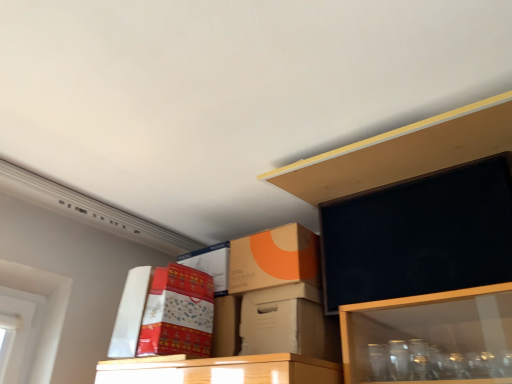
Question: Considering the relative positions of orange matte cardboard box at upper center, positioned as the second box in right-to-left order, and matte cardboard box at upper center in the image provided, is orange matte cardboard box at upper center, positioned as the second box in right-to-left order, behind matte cardboard box at upper center?

Choices:
 (A) no
 (B) yes

Answer: (B)

Question: Is orange matte cardboard box at upper center, positioned as the second box in right-to-left order, to the right of matte cardboard box at upper center from the viewer's perspective?

Choices:
 (A) no
 (B) yes

Answer: (B)

Question: From the image's perspective, is orange matte cardboard box at upper center, which is the second box in left-to-right order, located beneath matte cardboard box at upper center?

Choices:
 (A) no
 (B) yes

Answer: (A)

Question: Is matte cardboard box at upper center a part of orange matte cardboard box at upper center, which is the second box in left-to-right order?

Choices:
 (A) yes
 (B) no

Answer: (B)

Question: From a real-world perspective, is orange matte cardboard box at upper center, positioned as the second box in right-to-left order, beneath matte cardboard box at upper center?

Choices:
 (A) no
 (B) yes

Answer: (A)

Question: Is matte cardboard box at upper center taller or shorter than white cardboard box at center, which is the 1th box from right to left?

Choices:
 (A) short
 (B) tall

Answer: (B)

Question: Considering their positions, is matte cardboard box at upper center located in front of or behind white cardboard box at center, the third box from the left?

Choices:
 (A) front
 (B) behind

Answer: (A)

Question: Is matte cardboard box at upper center wider or thinner than white cardboard box at center, which is the 1th box from right to left?

Choices:
 (A) thin
 (B) wide

Answer: (B)

Question: From the image's perspective, is matte cardboard box at upper center located above or below white cardboard box at center, which is the 1th box from right to left?

Choices:
 (A) below
 (B) above

Answer: (B)

Question: From the image's perspective, is white cardboard box at center, which is the 1th box from right to left, positioned above or below matte cardboard box at upper center?

Choices:
 (A) above
 (B) below

Answer: (B)

Question: Choose the correct answer: Is white cardboard box at center, which is the 1th box from right to left, inside matte cardboard box at upper center or outside it?

Choices:
 (A) outside
 (B) inside

Answer: (A)

Question: From a real-world perspective, is white cardboard box at center, the third box from the left, above or below matte cardboard box at upper center?

Choices:
 (A) below
 (B) above

Answer: (A)

Question: Is point (262, 329) closer or farther from the camera than point (157, 299)?

Choices:
 (A) farther
 (B) closer

Answer: (B)

Question: From the image's perspective, is matte cardboard box at upper center above or below orange matte cardboard box at upper center, which is the second box in left-to-right order?

Choices:
 (A) above
 (B) below

Answer: (B)

Question: Looking at their shapes, would you say matte cardboard box at upper center is wider or thinner than orange matte cardboard box at upper center, positioned as the second box in right-to-left order?

Choices:
 (A) thin
 (B) wide

Answer: (B)